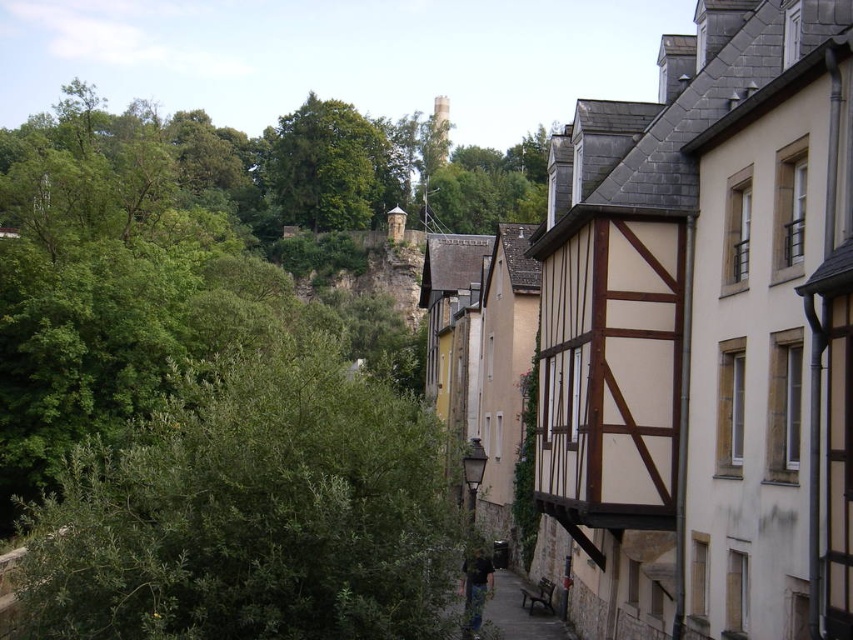
Question: Does green leafy bush at left appear over green leafy tree at upper center?

Choices:
 (A) yes
 (B) no

Answer: (B)

Question: Which point is farther to the camera?

Choices:
 (A) (74, 600)
 (B) (305, 106)

Answer: (B)

Question: Which point appears closest to the camera in this image?

Choices:
 (A) pos(311,161)
 (B) pos(402,401)

Answer: (B)

Question: Is green leafy bush at left bigger than green leafy tree at upper center?

Choices:
 (A) yes
 (B) no

Answer: (B)

Question: Does green leafy bush at left appear on the right side of green leafy tree at upper center?

Choices:
 (A) yes
 (B) no

Answer: (A)